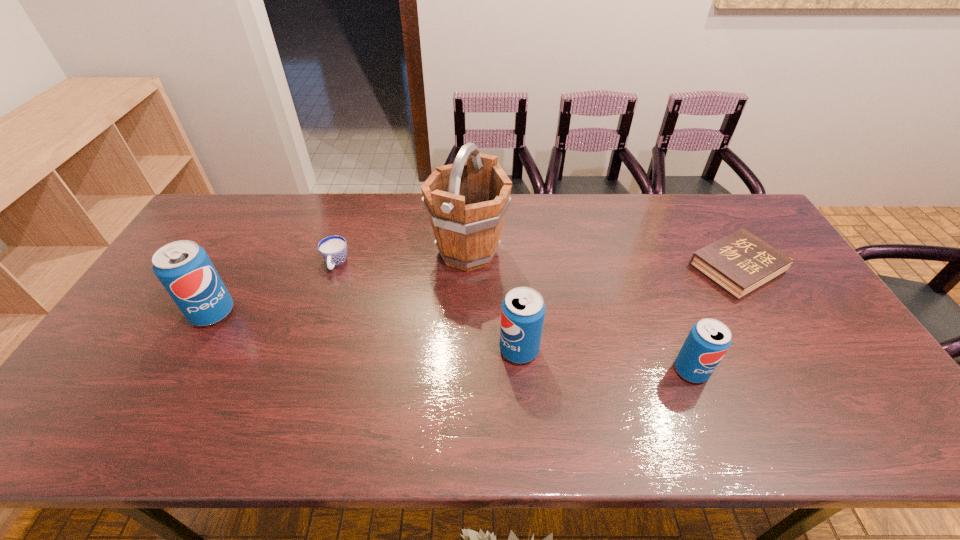
This screenshot has width=960, height=540. I want to click on object situated at the right edge, so click(x=739, y=263).

The image size is (960, 540). In the image, there is a desktop. In order to click on free space at the far edge in this screenshot , I will do `click(381, 224)`.

Locate an element on the screen. The width and height of the screenshot is (960, 540). blank area at the near edge is located at coordinates (277, 374).

Where is `vacant space at the right edge of the desktop`? This screenshot has width=960, height=540. vacant space at the right edge of the desktop is located at coordinates (800, 334).

Locate an element on the screen. free space at the near left corner is located at coordinates (134, 391).

In the image, there is a desktop. At what (x,y) coordinates should I click in order to perform the action: click on free space at the far right corner. Please return your answer as a coordinate pair (x, y). Image resolution: width=960 pixels, height=540 pixels. Looking at the image, I should click on (734, 215).

At what (x,y) coordinates should I click in order to perform the action: click on vacant space that is in between the fifth object from right to left and the third tallest object. Please return your answer as a coordinate pair (x, y). This screenshot has height=540, width=960. Looking at the image, I should click on (427, 307).

At what (x,y) coordinates should I click in order to perform the action: click on free space between the second shortest soda can and the shortest object. Please return your answer as a coordinate pair (x, y). Looking at the image, I should click on (628, 309).

Locate an element on the screen. free space between the rightmost soda can and the second soda can from right to left is located at coordinates (605, 360).

Where is `free space between the farthest soda can and the rightmost soda can`? The width and height of the screenshot is (960, 540). free space between the farthest soda can and the rightmost soda can is located at coordinates (452, 341).